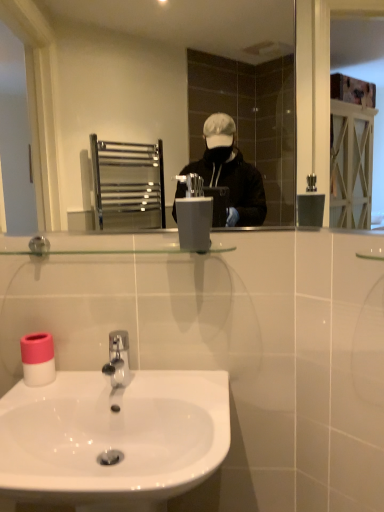
This screenshot has height=512, width=384. What are the coordinates of `vacant space in front of white matte toilet paper at lower left` in the screenshot? It's located at (35, 393).